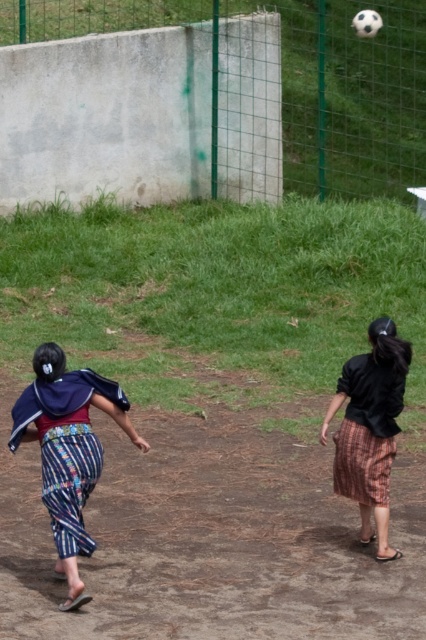
Is striped fabric pants at lower left taller than black cotton shirt at center?

Incorrect, striped fabric pants at lower left's height is not larger of black cotton shirt at center's.

Does striped fabric pants at lower left appear on the right side of black cotton shirt at center?

No, striped fabric pants at lower left is not to the right of black cotton shirt at center.

Which is in front, point (43, 381) or point (377, 365)?

Point (43, 381) is more forward.

Locate an element on the screen. Image resolution: width=426 pixels, height=640 pixels. striped fabric pants at lower left is located at coordinates (68, 451).